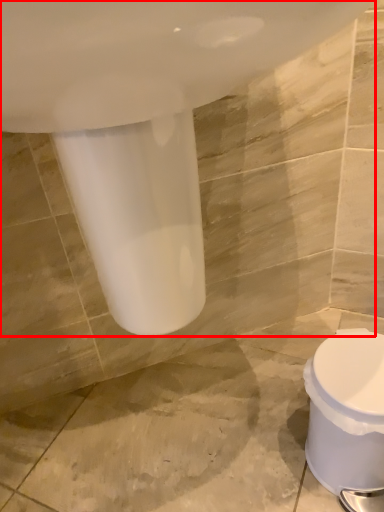
Question: From the image's perspective, where is bath (annotated by the red box) located in relation to toilet in the image?

Choices:
 (A) below
 (B) above

Answer: (B)